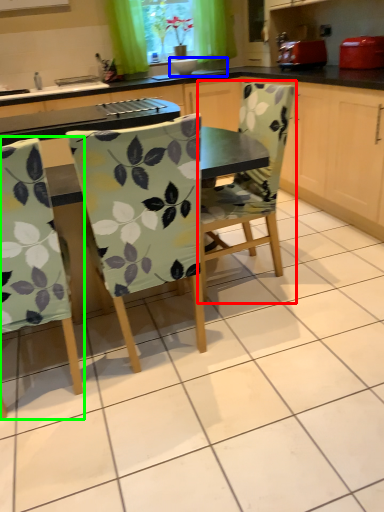
Question: Which is nearer to the chair (highlighted by a red box)? sink (highlighted by a blue box) or chair (highlighted by a green box).

Choices:
 (A) sink
 (B) chair

Answer: (B)